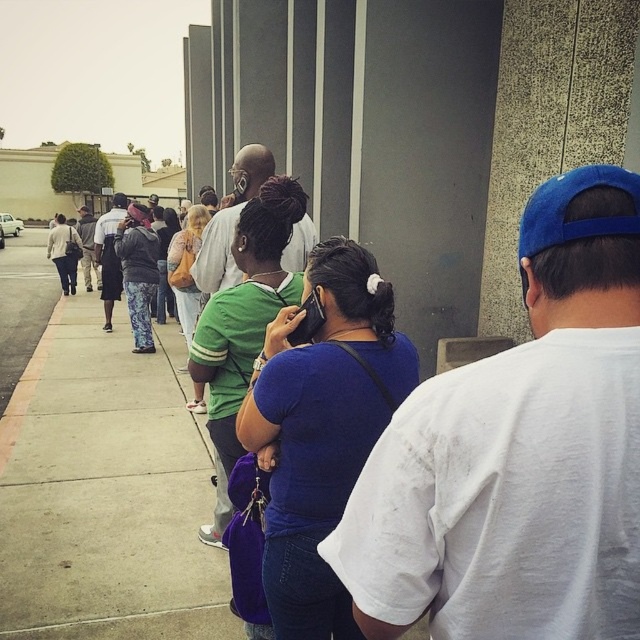
Looking at this image, you are standing at the entrance of the building and want to find the person wearing the white cotton shirt at center. According to the spatial coordinates provided, in which direction should you look relative to your current position?

The white cotton shirt at center is located at point coordinates, so you should look towards the lower right direction from your current position at the entrance.

You are standing at the entrance of the building and want to locate the person wearing the blue matte shirt at center. According to the spatial coordinates provided, in which direction relative to the entrance should you look to find them?

The blue matte shirt at center is located at point coordinates, so you should look towards the center area of the scene to find them.